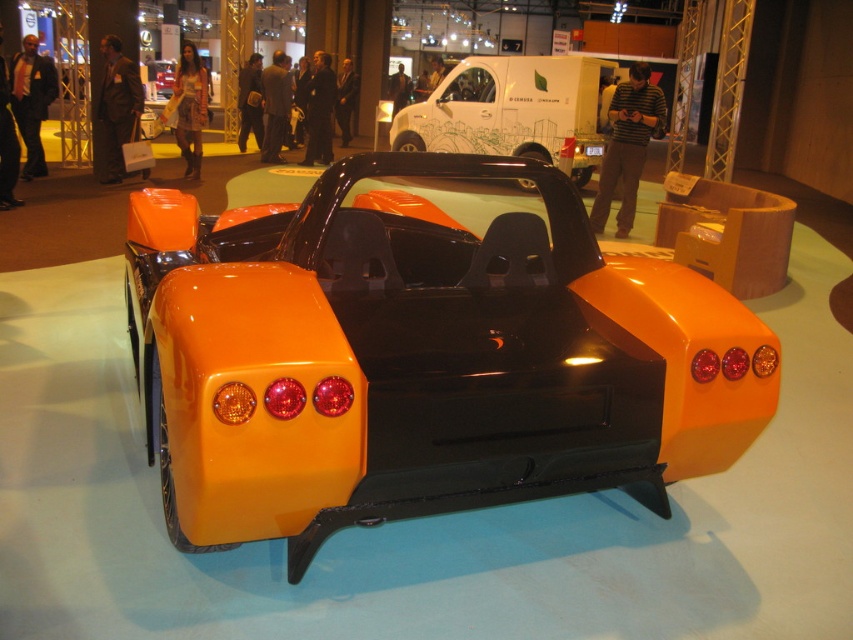
Between glossy orange car at center and white glossy van at upper center, which one appears on the left side from the viewer's perspective?

Positioned to the left is glossy orange car at center.

Who is taller, glossy orange car at center or white glossy van at upper center?

Standing taller between the two is white glossy van at upper center.

What do you see at coordinates (421, 356) in the screenshot? I see `glossy orange car at center` at bounding box center [421, 356].

Identify the location of glossy orange car at center. The height and width of the screenshot is (640, 853). (421, 356).